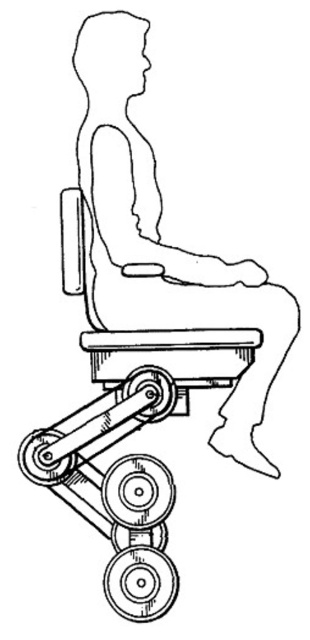
Question: Is black line drawing of person at center below matte plastic chair at center?

Choices:
 (A) yes
 (B) no

Answer: (B)

Question: From the image, what is the correct spatial relationship of black line drawing of person at center in relation to matte plastic chair at center?

Choices:
 (A) right
 (B) left

Answer: (A)

Question: From the image, what is the correct spatial relationship of black line drawing of person at center in relation to matte plastic chair at center?

Choices:
 (A) left
 (B) right

Answer: (B)